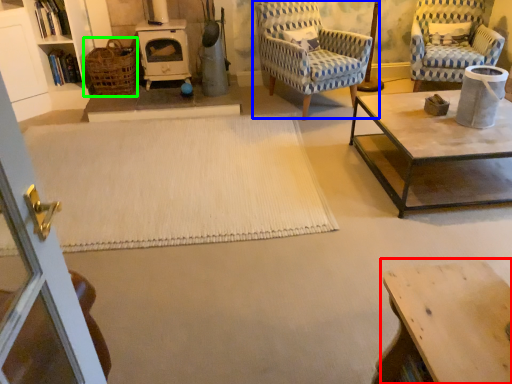
Question: Estimate the real-world distances between objects in this image. Which object is closer to table (highlighted by a red box), chair (highlighted by a blue box) or basket (highlighted by a green box)?

Choices:
 (A) chair
 (B) basket

Answer: (A)